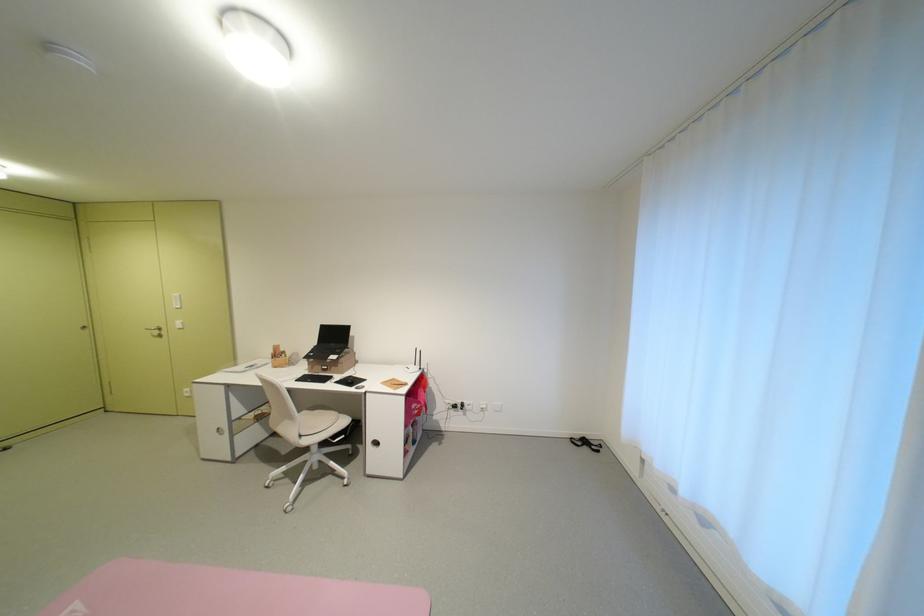
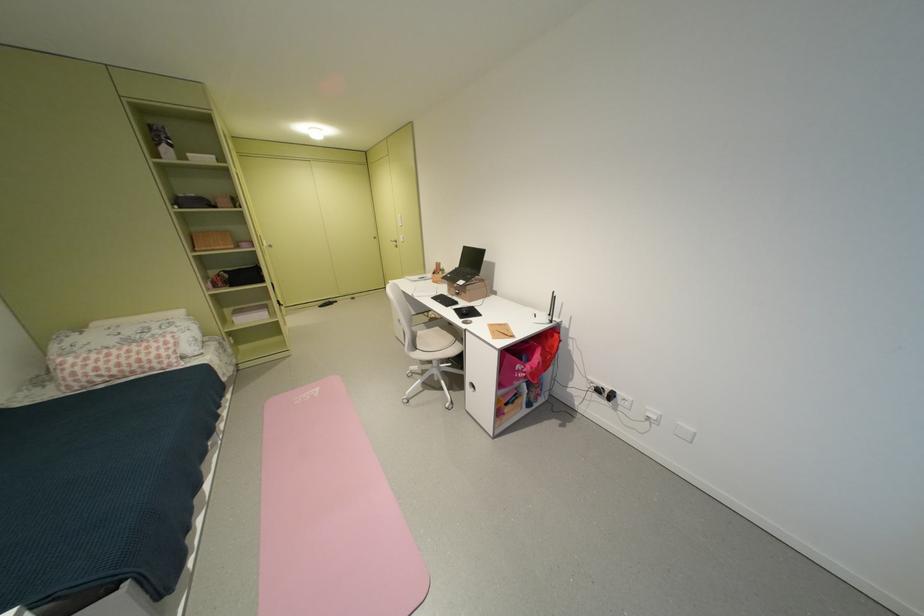
Find the pixel in the second image that matches point (311, 436) in the first image.

(428, 349)